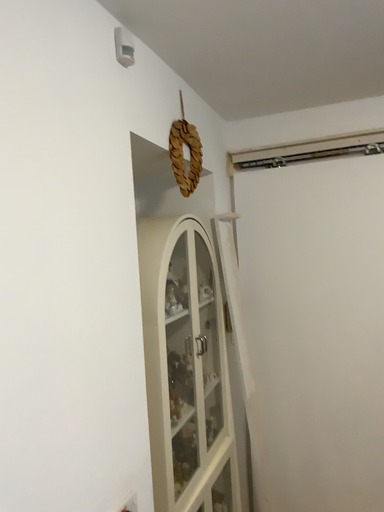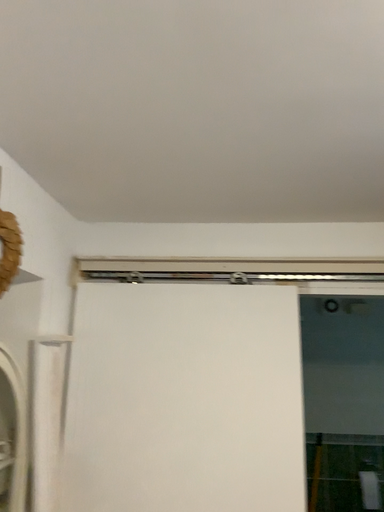
Question: Which way did the camera rotate in the video?

Choices:
 (A) rotated left
 (B) rotated right

Answer: (B)